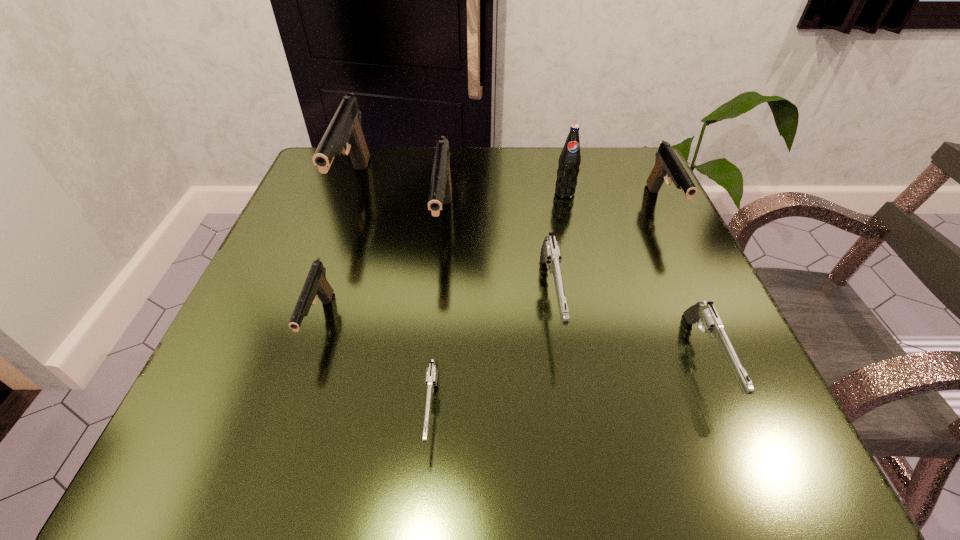
Locate an element on the screen. The image size is (960, 540). vacant region located 0.070m on the front-facing side of the seventh object from left to right is located at coordinates (754, 472).

In order to click on pop that is at the far edge in this screenshot , I will do `click(570, 158)`.

Locate an element on the screen. The image size is (960, 540). object present at the far left corner is located at coordinates (345, 129).

Image resolution: width=960 pixels, height=540 pixels. I want to click on object present at the far right corner, so [x=667, y=164].

At what (x,y) coordinates should I click in order to perform the action: click on object that is positioned at the near right corner. Please return your answer as a coordinate pair (x, y). The image size is (960, 540). Looking at the image, I should click on (704, 314).

The image size is (960, 540). In the image, there is a desktop. Identify the location of free space at the far edge. (470, 175).

The image size is (960, 540). Find the location of `free space at the left edge of the desktop`. free space at the left edge of the desktop is located at coordinates point(319,362).

The height and width of the screenshot is (540, 960). I want to click on vacant space at the right edge of the desktop, so click(x=613, y=280).

The width and height of the screenshot is (960, 540). What are the coordinates of `vacant space at the far left corner of the desktop` in the screenshot? It's located at (332, 167).

The height and width of the screenshot is (540, 960). In order to click on free space at the near left corner of the desktop in this screenshot , I will do `click(278, 418)`.